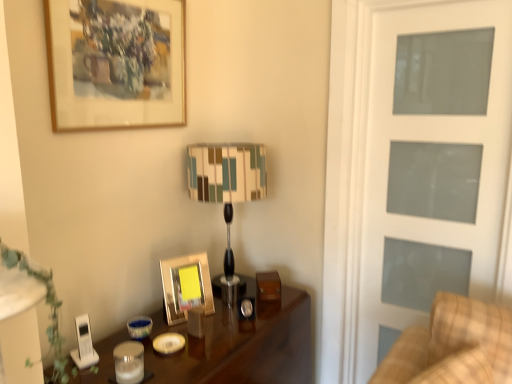
Image resolution: width=512 pixels, height=384 pixels. I want to click on vacant area located to the right-hand side of gold metallic picture frame at center, which ranks as the 2th picture frame in top-to-bottom order, so [x=226, y=314].